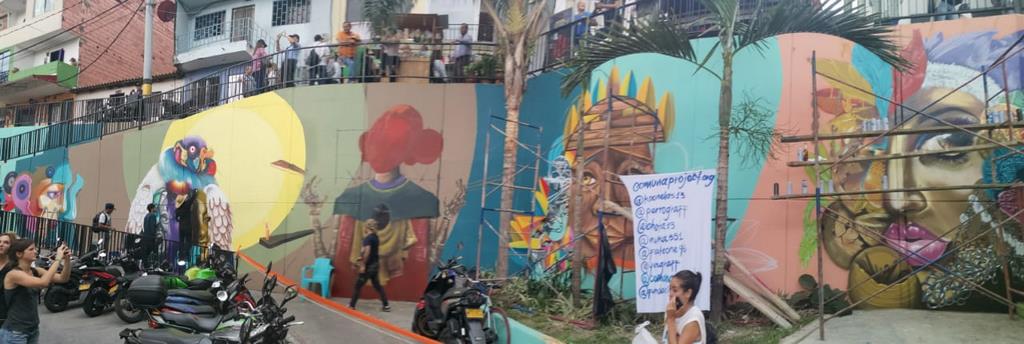
Locate an element on the screen. chair is located at coordinates (314, 275).